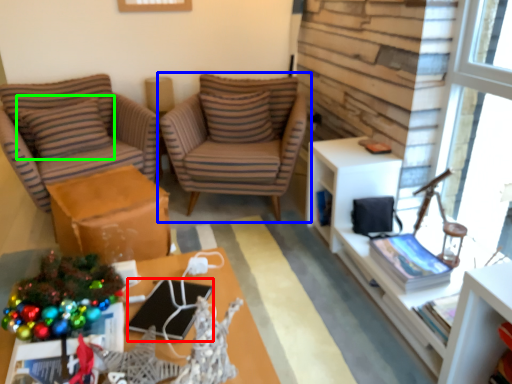
Question: Estimate the real-world distances between objects in this image. Which object is farther from laptop (highlighted by a red box), chair (highlighted by a blue box) or pillow (highlighted by a green box)?

Choices:
 (A) chair
 (B) pillow

Answer: (B)